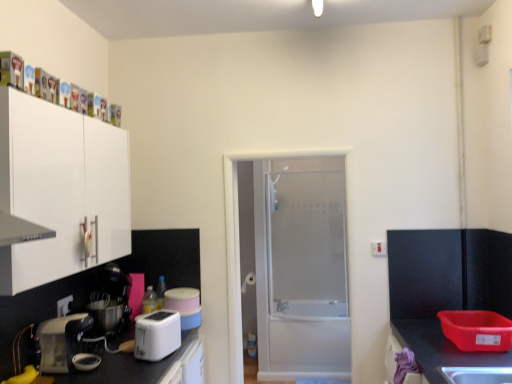
Question: Is white plastic electric outlet at upper right, which is the second electric outlet from front to back, bigger than matte black mixer at lower left, the first appliance when ordered from left to right?

Choices:
 (A) no
 (B) yes

Answer: (A)

Question: Is white plastic electric outlet at upper right, which is the 2th electric outlet in bottom-to-top order, located outside matte black mixer at lower left, placed as the second appliance when sorted from right to left?

Choices:
 (A) no
 (B) yes

Answer: (B)

Question: From the image's perspective, is white plastic electric outlet at upper right, which is the 2th electric outlet in bottom-to-top order, located beneath matte black mixer at lower left, placed as the second appliance when sorted from right to left?

Choices:
 (A) yes
 (B) no

Answer: (B)

Question: Does white plastic electric outlet at upper right, the 1th electric outlet from the right, appear on the left side of matte black mixer at lower left, placed as the second appliance when sorted from right to left?

Choices:
 (A) yes
 (B) no

Answer: (B)

Question: Could you tell me if white plastic electric outlet at upper right, marked as the 2th electric outlet in a left-to-right arrangement, is facing matte black mixer at lower left, placed as the second appliance when sorted from right to left?

Choices:
 (A) yes
 (B) no

Answer: (B)

Question: Considering the positions of matte black mixer at lower left, placed as the second appliance when sorted from right to left, and white plastic toaster at lower left, the first kitchen appliance viewed from the right, in the image, is matte black mixer at lower left, placed as the second appliance when sorted from right to left, bigger or smaller than white plastic toaster at lower left, the first kitchen appliance viewed from the right,?

Choices:
 (A) big
 (B) small

Answer: (A)

Question: From a real-world perspective, relative to white plastic toaster at lower left, which is the second kitchen appliance from left to right, is matte black mixer at lower left, the first appliance when ordered from left to right, vertically above or below?

Choices:
 (A) above
 (B) below

Answer: (A)

Question: From their relative heights in the image, would you say matte black mixer at lower left, the first appliance when ordered from left to right, is taller or shorter than white plastic toaster at lower left, the first kitchen appliance viewed from the right?

Choices:
 (A) short
 (B) tall

Answer: (B)

Question: In the image, is matte black mixer at lower left, placed as the second appliance when sorted from right to left, positioned in front of or behind white plastic toaster at lower left, which is the second kitchen appliance from left to right?

Choices:
 (A) behind
 (B) front

Answer: (A)

Question: Is white frosted glass door at center wider or thinner than white plastic toaster at lower left, the first kitchen appliance viewed from the right?

Choices:
 (A) thin
 (B) wide

Answer: (B)

Question: In the image, is white frosted glass door at center positioned in front of or behind white plastic toaster at lower left, which is the second kitchen appliance from left to right?

Choices:
 (A) behind
 (B) front

Answer: (A)

Question: Based on their positions, is white frosted glass door at center located to the left or right of white plastic toaster at lower left, which is the second kitchen appliance from left to right?

Choices:
 (A) right
 (B) left

Answer: (A)

Question: From the image's perspective, is white frosted glass door at center above or below white plastic toaster at lower left, which is the second kitchen appliance from left to right?

Choices:
 (A) above
 (B) below

Answer: (A)

Question: Does point (177, 316) appear closer or farther from the camera than point (200, 314)?

Choices:
 (A) closer
 (B) farther

Answer: (A)

Question: Is white plastic toaster at lower left, which is the second kitchen appliance from left to right, situated inside white plastic toaster at lower center, the first appliance positioned from the right, or outside?

Choices:
 (A) inside
 (B) outside

Answer: (B)